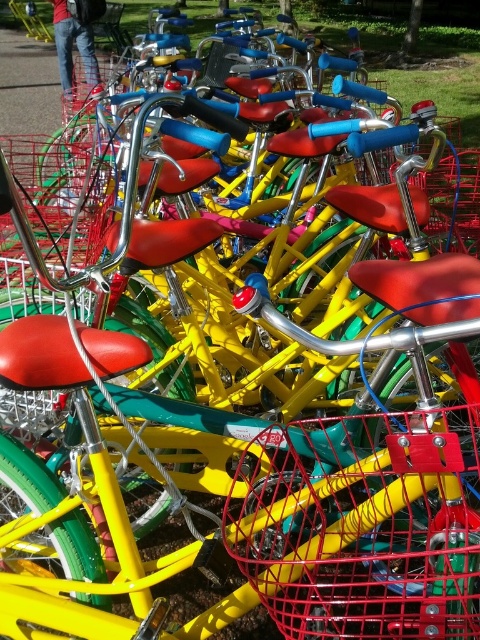
Question: Does red wire basket at center have a greater width compared to metallic wire basket at lower left?

Choices:
 (A) no
 (B) yes

Answer: (B)

Question: Does red wire basket at center have a larger size compared to metallic wire basket at lower left?

Choices:
 (A) no
 (B) yes

Answer: (B)

Question: Is red wire basket at center smaller than metallic wire basket at lower left?

Choices:
 (A) yes
 (B) no

Answer: (B)